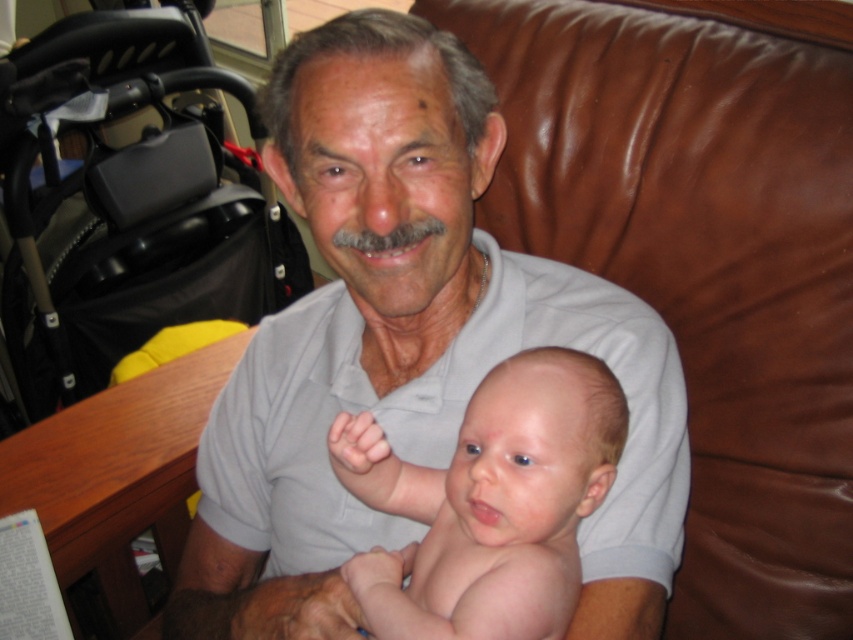
You are a photographer taking a photo of the scene. You want to focus on the gray cotton shirt at center and the black plastic stroller at left. Which object is positioned more to the left side of the image?

The black plastic stroller at left is positioned more to the left side of the image compared to the gray cotton shirt at center.

You are a photographer setting up for a family photo. You need to ensure the black plastic stroller at left and the smooth skin baby at center are both in focus. Since the stroller is taller than the baby, where should you position the camera to capture both effectively?

The black plastic stroller at left is taller than the smooth skin baby at center. To capture both in focus, position the camera at a mid height between the two, ensuring both are within the depth of field.